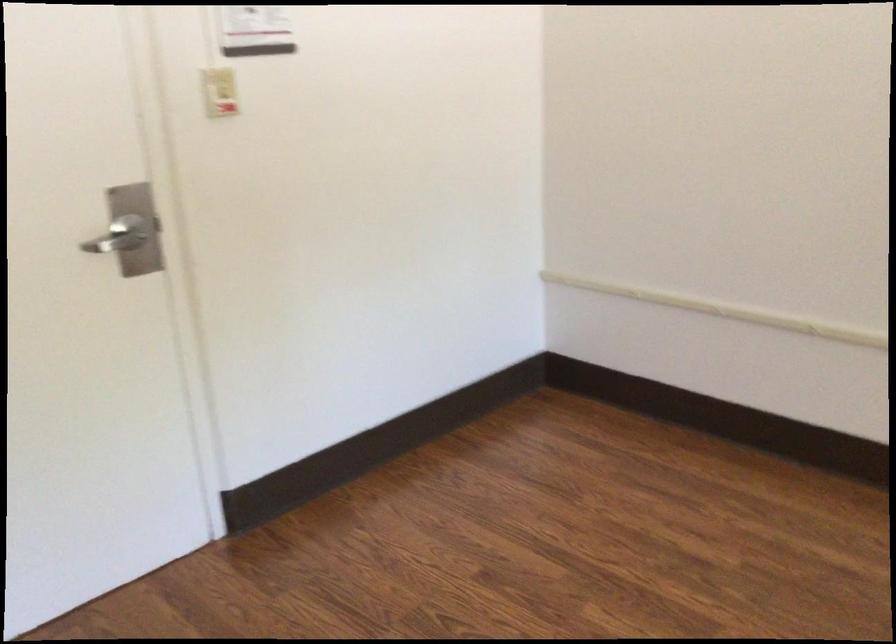
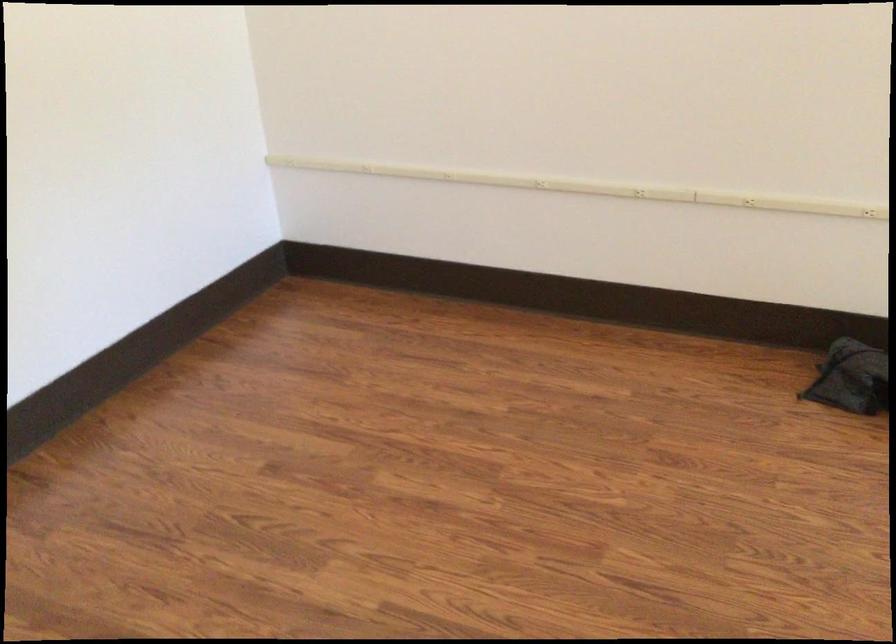
The point at (687, 301) is marked in the first image. Where is the corresponding point in the second image?

(421, 173)